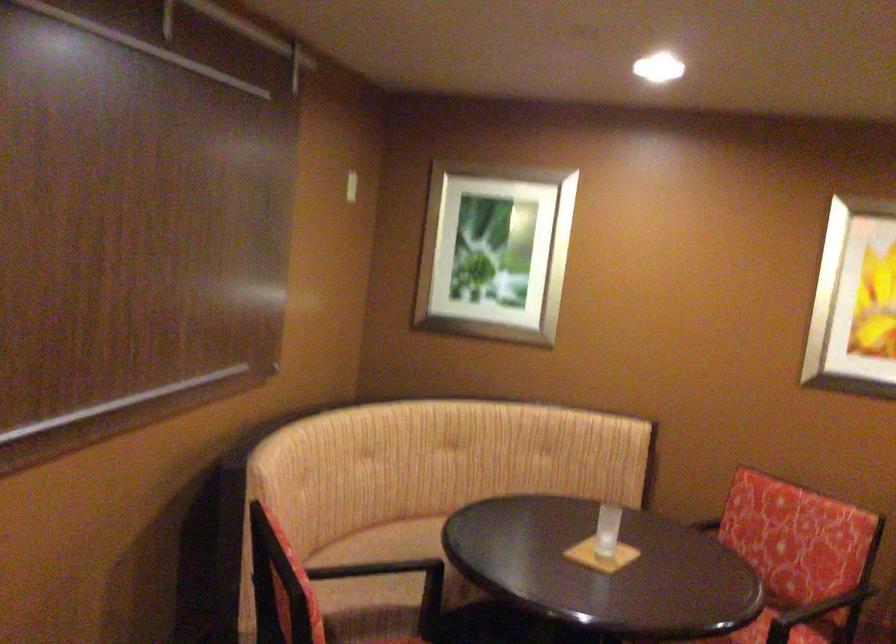
This screenshot has width=896, height=644. Describe the element at coordinates (350, 185) in the screenshot. I see `a white light switch` at that location.